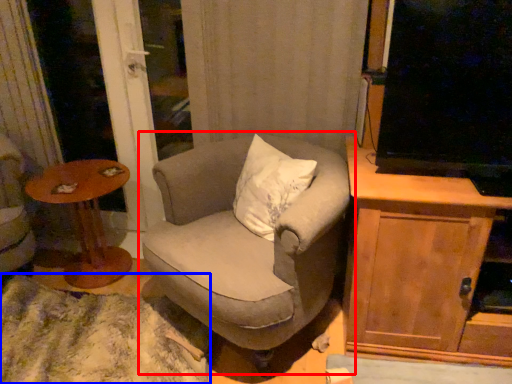
Question: Which of the following is the farthest to the observer, chair (highlighted by a red box) or plain (highlighted by a blue box)?

Choices:
 (A) chair
 (B) plain

Answer: (B)